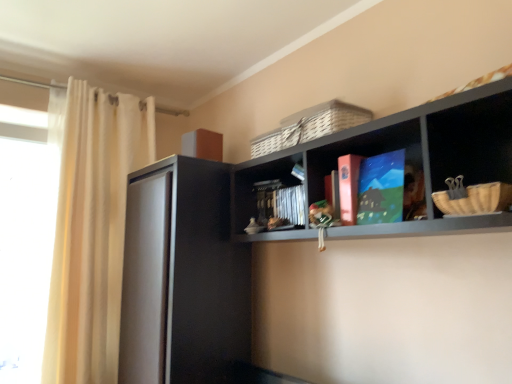
Question: From the image's perspective, is transparent glass window at left over white sheer curtain at left?

Choices:
 (A) no
 (B) yes

Answer: (A)

Question: Is white sheer curtain at left located within transparent glass window at left?

Choices:
 (A) yes
 (B) no

Answer: (B)

Question: Does transparent glass window at left appear on the left side of white sheer curtain at left?

Choices:
 (A) no
 (B) yes

Answer: (B)

Question: Does transparent glass window at left have a lesser width compared to white sheer curtain at left?

Choices:
 (A) no
 (B) yes

Answer: (B)

Question: Would you say transparent glass window at left is outside white sheer curtain at left?

Choices:
 (A) no
 (B) yes

Answer: (B)

Question: From a real-world perspective, is transparent glass window at left physically below white sheer curtain at left?

Choices:
 (A) yes
 (B) no

Answer: (A)

Question: Can you confirm if matte black shelf at upper center is wider than transparent glass window at left?

Choices:
 (A) no
 (B) yes

Answer: (B)

Question: Does matte black shelf at upper center come behind transparent glass window at left?

Choices:
 (A) yes
 (B) no

Answer: (B)

Question: From a real-world perspective, does matte black shelf at upper center sit lower than transparent glass window at left?

Choices:
 (A) yes
 (B) no

Answer: (B)

Question: Are matte black shelf at upper center and transparent glass window at left far apart?

Choices:
 (A) no
 (B) yes

Answer: (B)

Question: From a real-world perspective, is matte black shelf at upper center on top of transparent glass window at left?

Choices:
 (A) no
 (B) yes

Answer: (B)

Question: Is the surface of matte black shelf at upper center in direct contact with transparent glass window at left?

Choices:
 (A) yes
 (B) no

Answer: (B)

Question: Does matte cardboard book at center, the second book in the front-to-back sequence, have a smaller size compared to black matte cabinet at left?

Choices:
 (A) yes
 (B) no

Answer: (A)